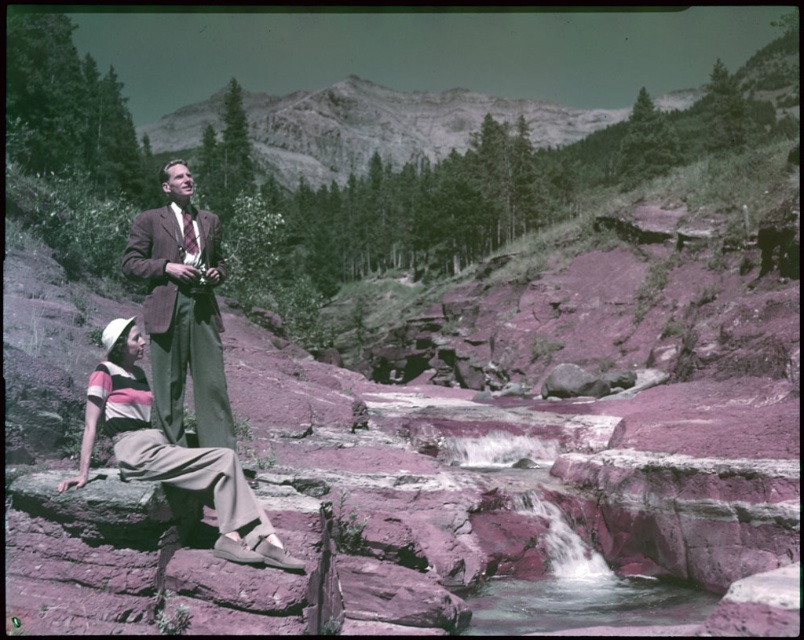
You are a photographer planning to take a group photo of the matte brown suit at center and the striped cotton shirt at lower left. The minimum distance required for your camera to focus clearly on both subjects simultaneously is 5 meters. Based on their current positions, will you be able to capture both subjects in focus?

The matte brown suit at center and the striped cotton shirt at lower left are 4.72 meters apart from each other. Since the required minimum distance is 5 meters, the photographer will not be able to capture both subjects in focus with the current camera settings.